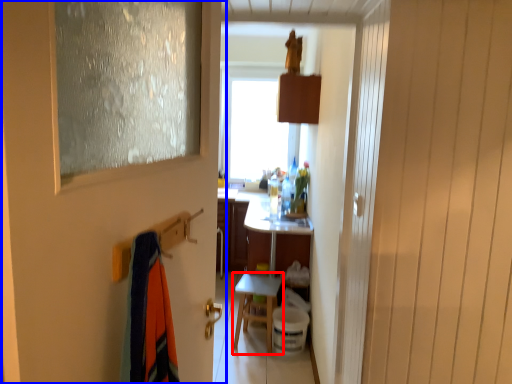
Question: Which point is closer to the camera, table (highlighted by a red box) or door (highlighted by a blue box)?

Choices:
 (A) table
 (B) door

Answer: (B)